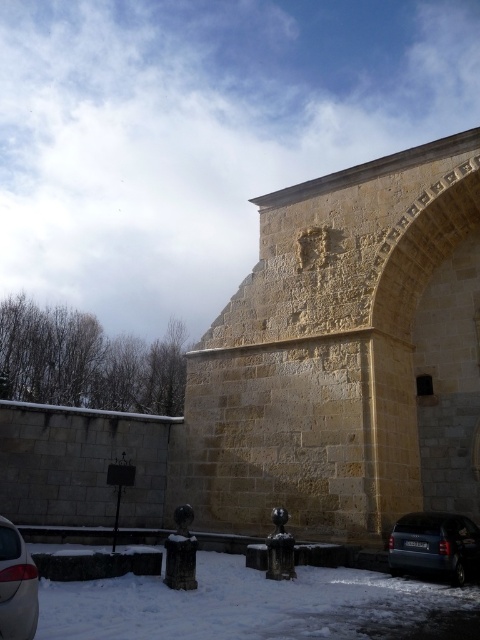
Is point (476, 540) in front of point (7, 552)?

No, (476, 540) is further to viewer.

Is point (444, 541) closer to viewer compared to point (11, 593)?

No.

Identify the location of dark blue metallic car at lower right. The width and height of the screenshot is (480, 640). [434, 545].

Between point (92, 618) and point (6, 547), which one is positioned in front?

Positioned in front is point (6, 547).

Is point (109, 609) more distant than point (36, 595)?

Yes, point (109, 609) is farther from viewer.

Locate an element on the screen. This screenshot has width=480, height=640. white powdery snow at lower left is located at coordinates (243, 604).

Is white powdery snow at lower left bigger than dark blue metallic car at lower right?

Yes, white powdery snow at lower left is bigger than dark blue metallic car at lower right.

Who is taller, white powdery snow at lower left or dark blue metallic car at lower right?

Standing taller between the two is white powdery snow at lower left.

Locate an element on the screen. white powdery snow at lower left is located at coordinates (243, 604).

At what (x,y) coordinates should I click in order to perform the action: click on white powdery snow at lower left. Please return your answer as a coordinate pair (x, y). This screenshot has height=640, width=480. Looking at the image, I should click on (243, 604).